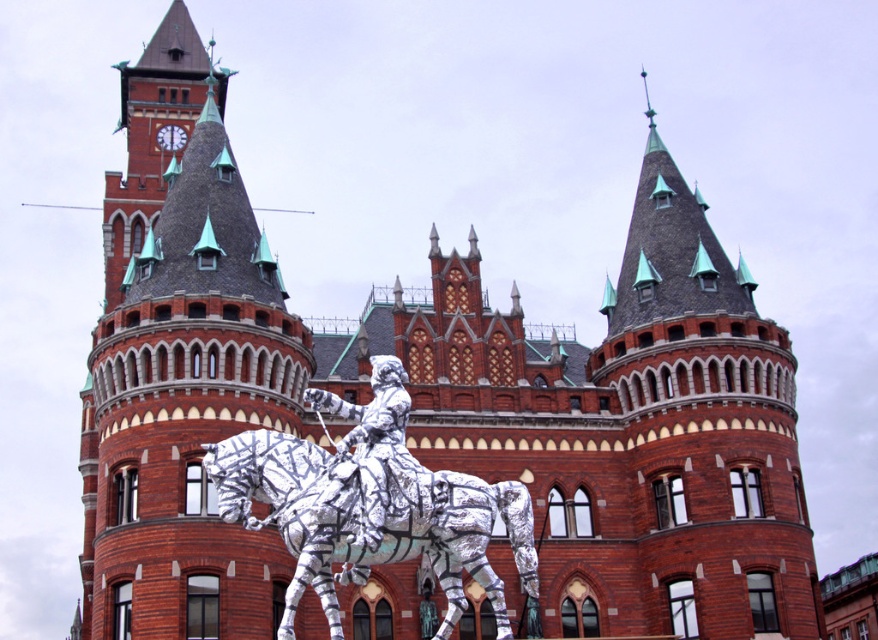
Is silver metallic horse at center thinner than silver metallic horseman at center?

No.

Does point (206, 472) come farther from viewer compared to point (384, 456)?

Yes, it is.

Identify the location of silver metallic horse at center. (358, 522).